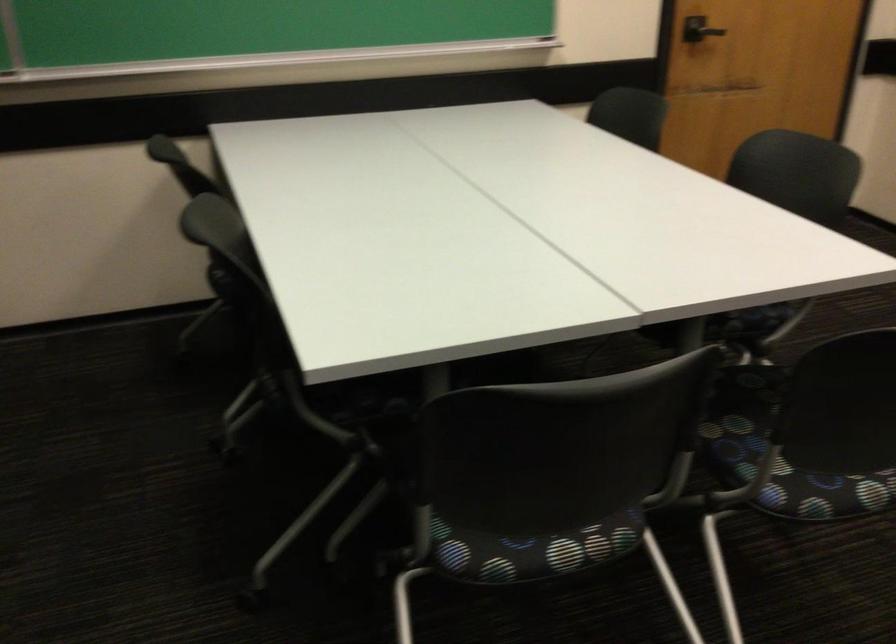
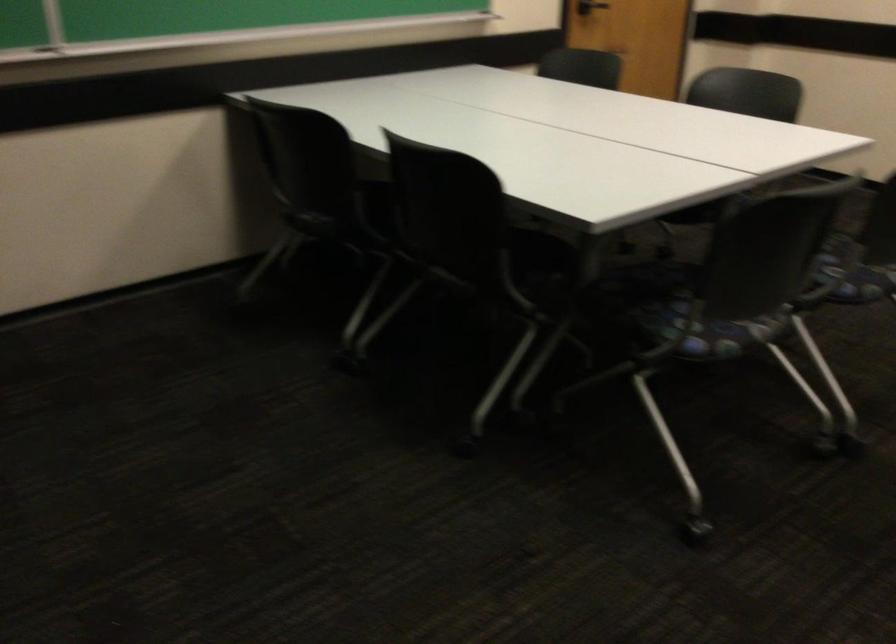
Find the pixel in the second image that matches (666,330) in the first image.

(703, 214)